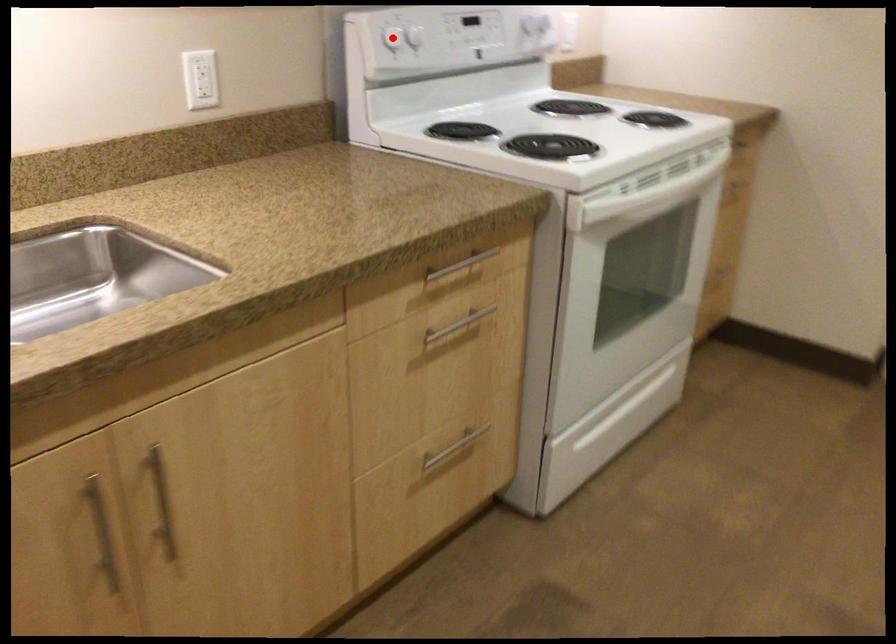
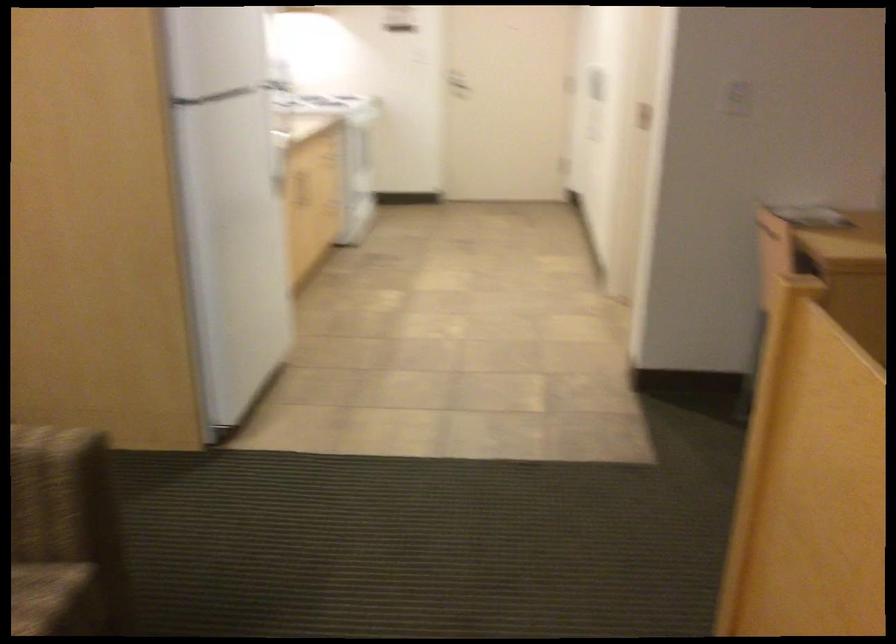
Question: I am providing you with two images of the same scene from different viewpoints. A red point is marked on the first image. Is the red point's position out of view in image 2?

Choices:
 (A) Yes
 (B) No

Answer: (A)